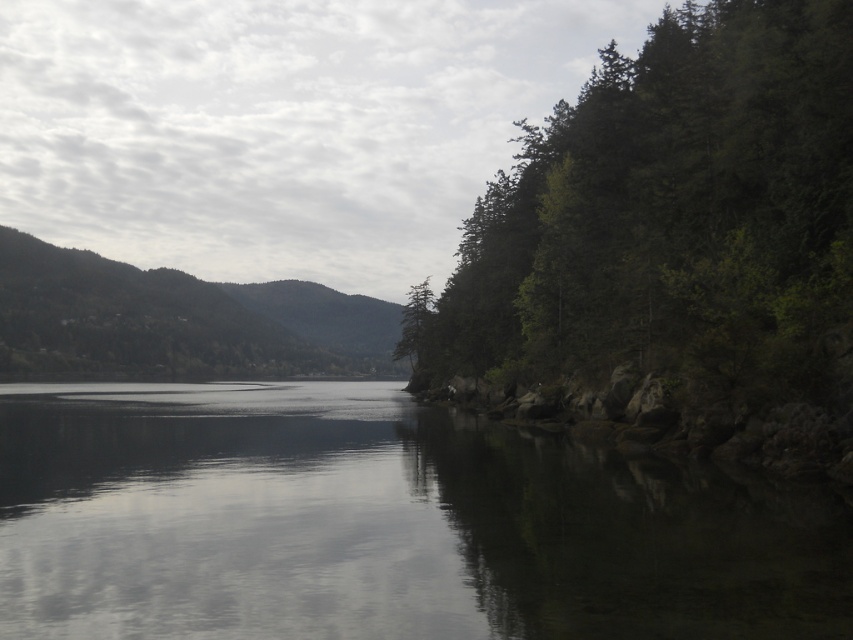
You are a kayaker planning to paddle from the smooth dark water at center to the green matte tree at center. Given that your kayak can only handle distances up to 60 meters, will you be able to reach the tree?

The distance between the smooth dark water at center and the green matte tree at center is 64.33 meters, which exceeds the kayak maximum range of 60 meters. Therefore, you cannot reach the tree.

You are standing on the left side of the image and want to walk towards the green matte tree at center. Which direction should you move relative to the smooth dark water at center?

You should move to the right of the smooth dark water at center because the green matte tree at center is to the right of it.

Please provide the exact coordinates of the smooth dark water at center in the image. The coordinate system uses a scale from 0 to 1 for both the x and y axes, with the origin at the bottom left corner of the image.

The smooth dark water at center is located at coordinates point (383, 524).